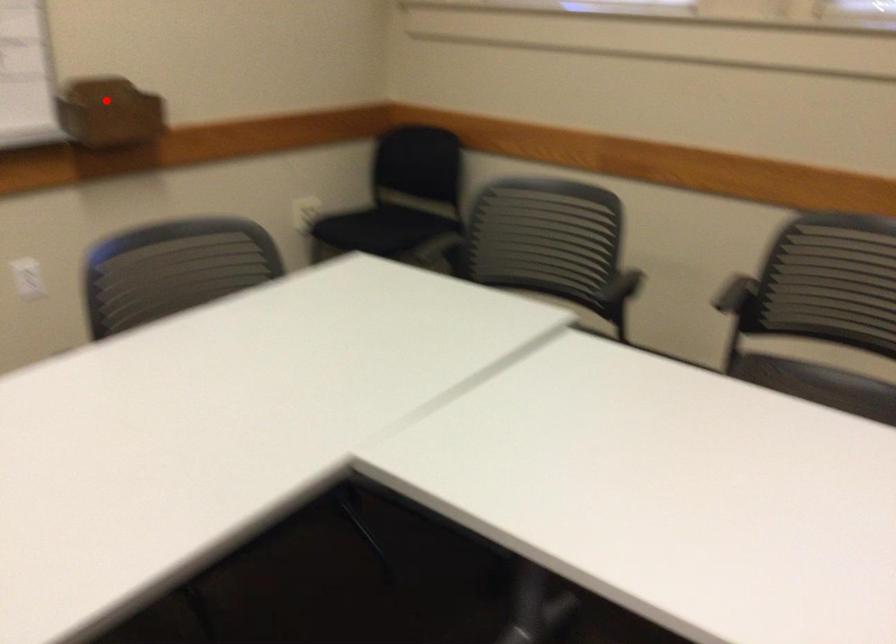
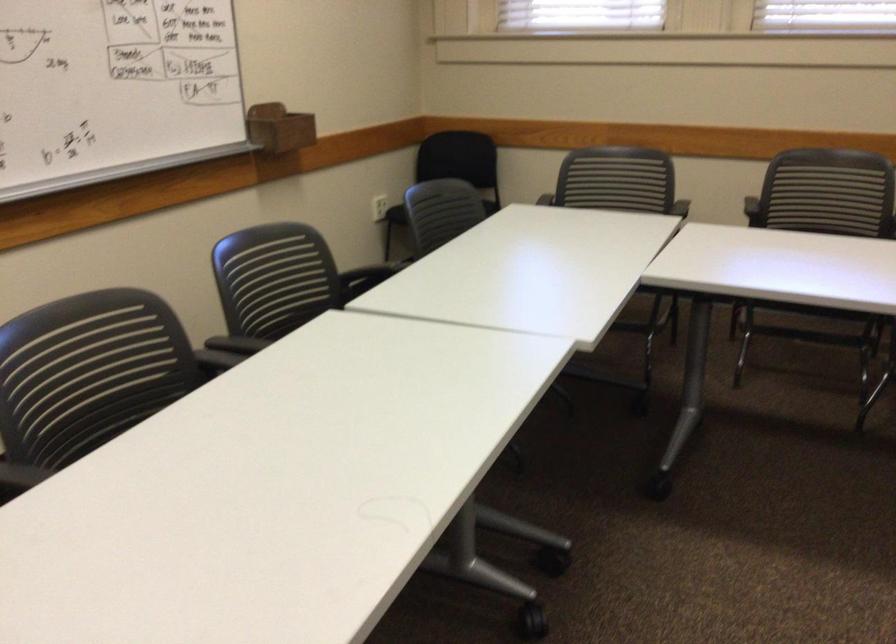
Where in the second image is the point corresponding to the highlighted location from the first image?

(279, 128)